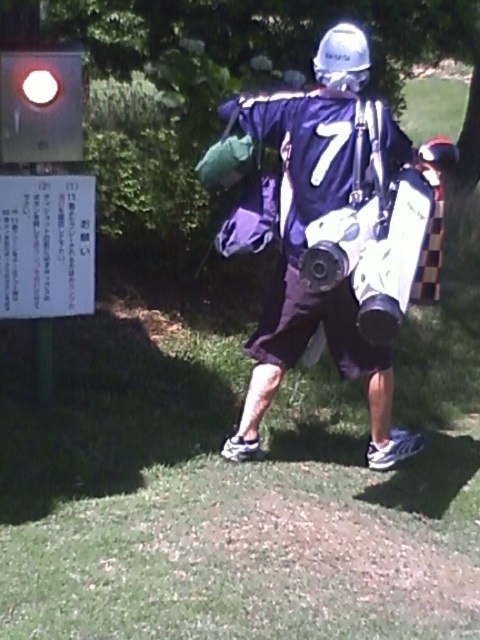
Question: Among these points, which one is nearest to the camera?

Choices:
 (A) (64, 154)
 (B) (46, 285)

Answer: (A)

Question: Estimate the real-world distances between objects in this image. Which object is farther from the purple matte jersey at center?

Choices:
 (A) white paper sign at left
 (B) matte glass traffic light at upper left

Answer: (B)

Question: Does purple matte jersey at center have a greater width compared to white paper sign at left?

Choices:
 (A) yes
 (B) no

Answer: (A)

Question: Which object is positioned closest to the matte glass traffic light at upper left?

Choices:
 (A) white paper sign at left
 (B) purple matte jersey at center

Answer: (A)

Question: Can you confirm if purple matte jersey at center is positioned to the left of matte glass traffic light at upper left?

Choices:
 (A) no
 (B) yes

Answer: (A)

Question: Does white paper sign at left have a lesser width compared to matte glass traffic light at upper left?

Choices:
 (A) yes
 (B) no

Answer: (B)